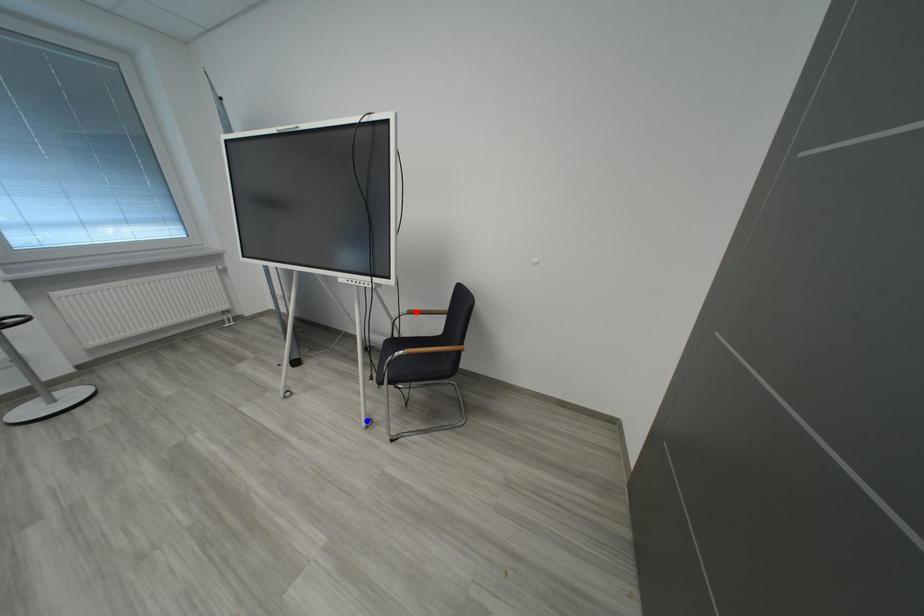
Question: Which of the two points in the image is closer to the camera?

Choices:
 (A) Blue point is closer.
 (B) Red point is closer.

Answer: (A)